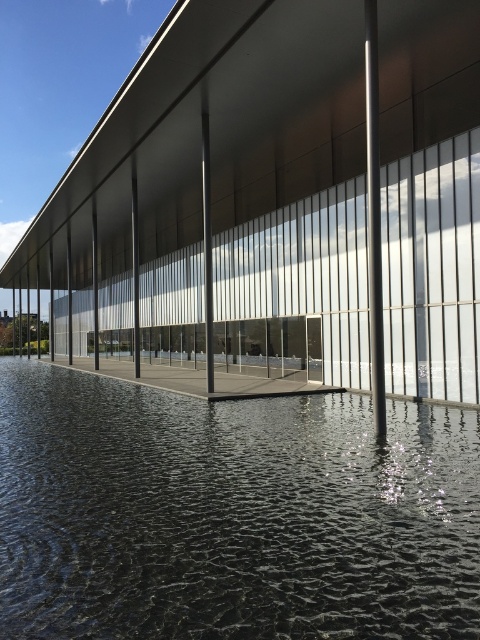
You are standing in front of the modern building and want to take a photo that includes both the black reflective water at center and the polished metal pole at center. Based on their positions, which object should you position to the right side of your camera frame to include both?

To include both the black reflective water at center and the polished metal pole at center in your photo, you should position the polished metal pole at center to the right side of your camera frame since the black reflective water at center is located to the left of it.

You are standing in front of the modern building and notice the black reflective water at center and the polished metal pole at center. Which object is positioned lower in the scene?

The black reflective water at center is located below the polished metal pole at center, so it is positioned lower in the scene.